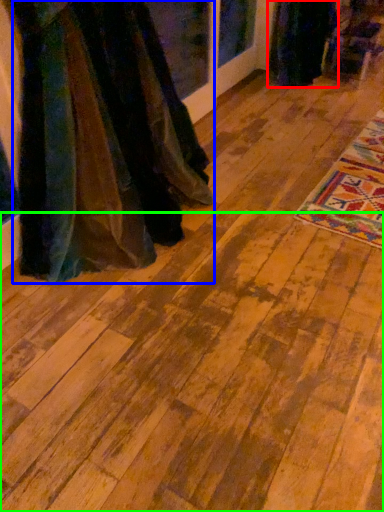
Question: Estimate the real-world distances between objects in this image. Which object is farther from fancy dress (highlighted by a red box), fancy dress (highlighted by a blue box) or plywood (highlighted by a green box)?

Choices:
 (A) fancy dress
 (B) plywood

Answer: (B)